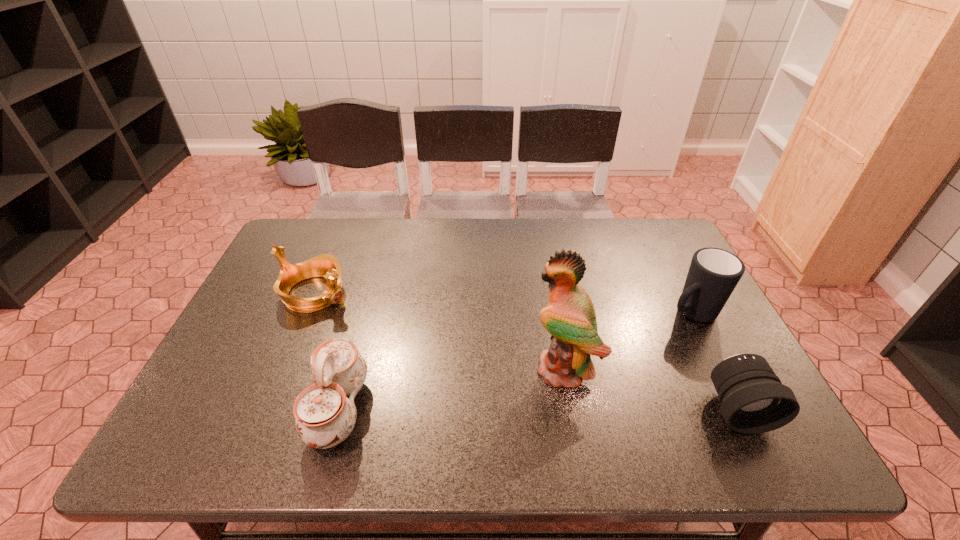
Identify the location of the second closest object relative to the mug. Image resolution: width=960 pixels, height=540 pixels. pos(569,317).

This screenshot has height=540, width=960. I want to click on object that is the second nearest to the telephoto lens, so click(569, 317).